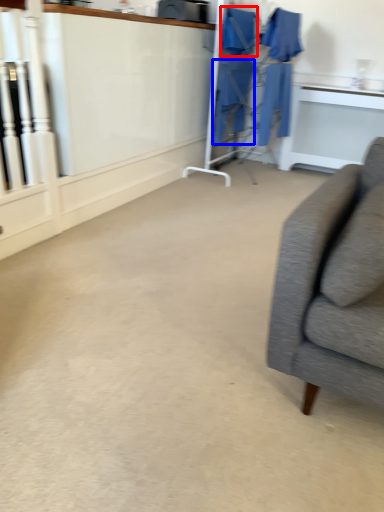
Question: Which of the following is the closest to the observer, robe (highlighted by a red box) or robe (highlighted by a blue box)?

Choices:
 (A) robe
 (B) robe

Answer: (A)